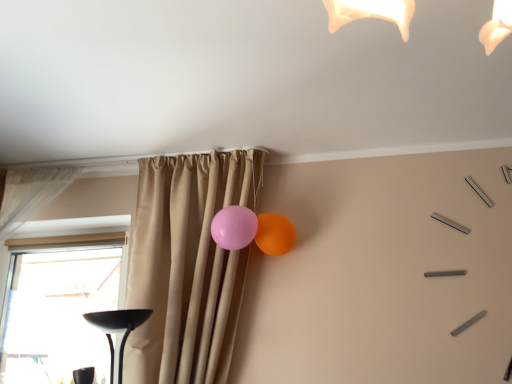
Question: Is transparent glass window at lower left inside or outside of matte rubber balloon at upper right, which appears as the 2th balloon when viewed from the left?

Choices:
 (A) inside
 (B) outside

Answer: (B)

Question: From a real-world perspective, is transparent glass window at lower left above or below matte rubber balloon at upper right, positioned as the 1th balloon in right-to-left order?

Choices:
 (A) above
 (B) below

Answer: (B)

Question: Estimate the real-world distances between objects in this image. Which object is farther from the beige curtain at center, the second curtain in the left-to-right sequence?

Choices:
 (A) white sheer curtain at left, arranged as the 2th curtain when viewed from the right
 (B) transparent glass window at lower left
 (C) pink rubber balloon at center, the 2th balloon positioned from the right
 (D) matte rubber balloon at upper right, which appears as the 2th balloon when viewed from the left

Answer: (B)

Question: Which object is positioned farthest from the pink rubber balloon at center, the first balloon when ordered from left to right?

Choices:
 (A) white sheer curtain at left, arranged as the 2th curtain when viewed from the right
 (B) beige curtain at center, which is the 1th curtain in right-to-left order
 (C) matte rubber balloon at upper right, positioned as the 1th balloon in right-to-left order
 (D) transparent glass window at lower left

Answer: (D)